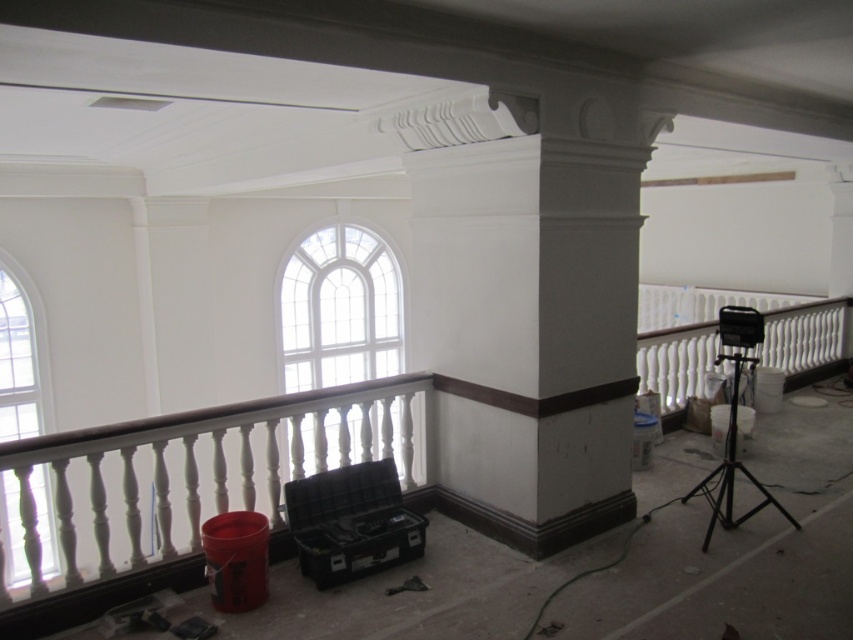
You are an interior designer evaluating the room layout. You see the white glass window at center and the clear glass window at left. Which window is located to the right of the other?

The white glass window at center is positioned on the right side of the clear glass window at left.